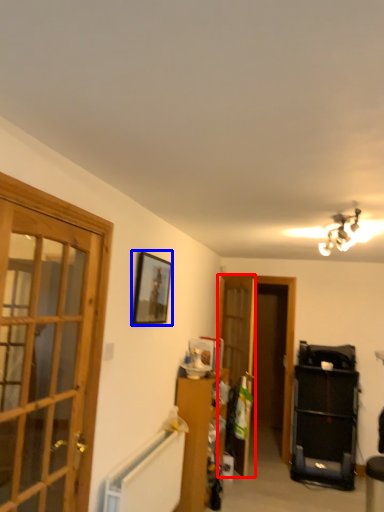
Question: Which object appears closest to the camera in this image, screen door (highlighted by a red box) or picture frame (highlighted by a blue box)?

Choices:
 (A) screen door
 (B) picture frame

Answer: (B)